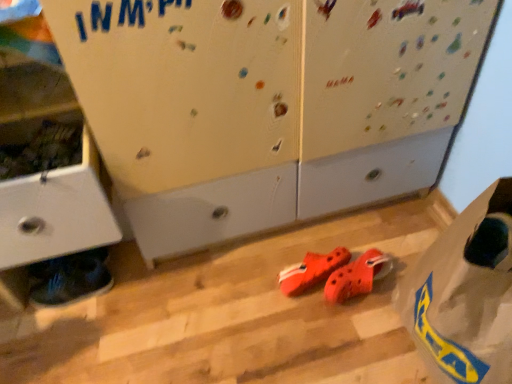
Where is `vacant space behind orange rubber clogs at center, placed as the first footwear when sorted from right to left`? Image resolution: width=512 pixels, height=384 pixels. vacant space behind orange rubber clogs at center, placed as the first footwear when sorted from right to left is located at coordinates (343, 231).